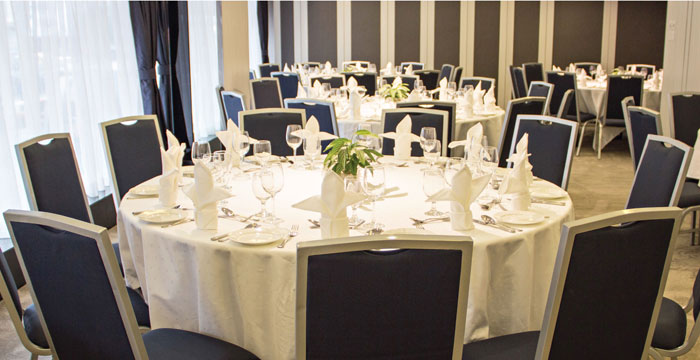
In order to click on plate in this screenshot , I will do `click(155, 214)`, `click(144, 183)`, `click(248, 235)`, `click(516, 214)`, `click(536, 194)`, `click(413, 234)`, `click(491, 163)`, `click(596, 85)`, `click(488, 109)`, `click(377, 117)`.